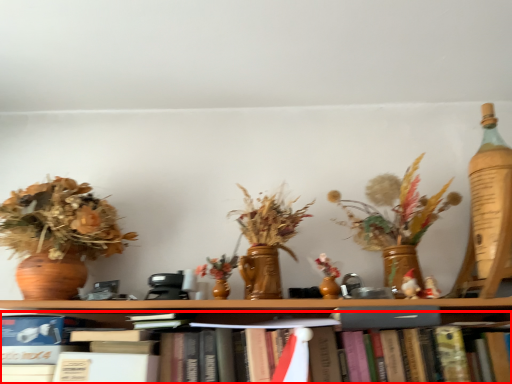
Question: From the image's perspective, considering the relative positions of book (annotated by the red box) and paperback book in the image provided, where is book (annotated by the red box) located with respect to the staircase?

Choices:
 (A) above
 (B) below

Answer: (B)